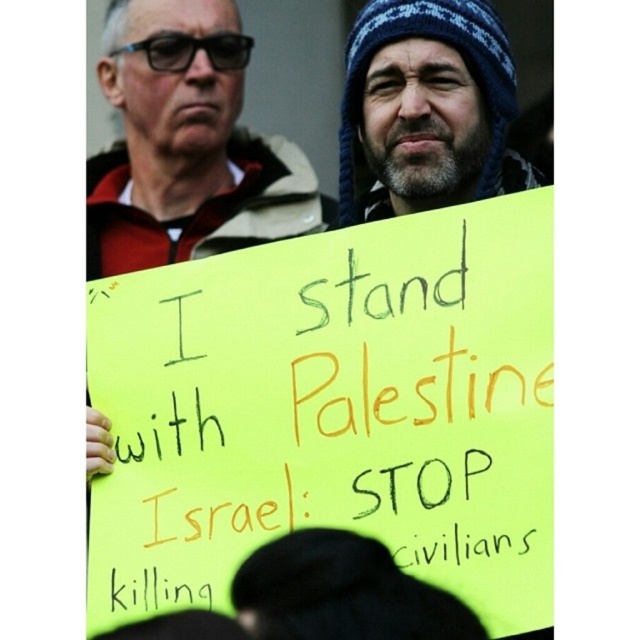
Who is positioned more to the left, matte black jacket at upper left or blue knitted hat at upper right?

Answer: matte black jacket at upper left is more to the left.

Which is above, matte black jacket at upper left or blue knitted hat at upper right?

matte black jacket at upper left

Find the location of a particular element. This screenshot has width=640, height=640. matte black jacket at upper left is located at coordinates (188, 145).